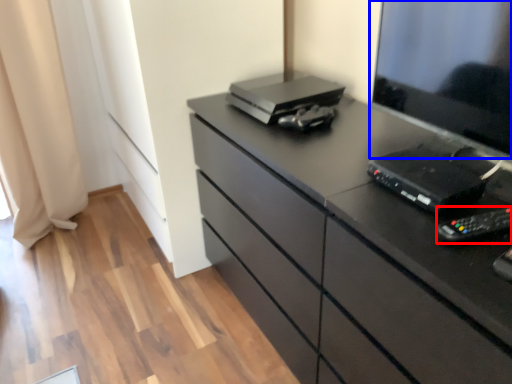
Question: Which object is further to the camera taking this photo, equipment (highlighted by a red box) or desktop (highlighted by a blue box)?

Choices:
 (A) equipment
 (B) desktop

Answer: (A)